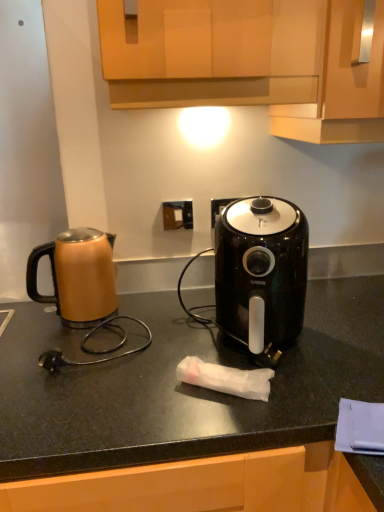
In order to click on vacant area that lies in front of matte brown kettle at left in this screenshot , I will do (x=71, y=360).